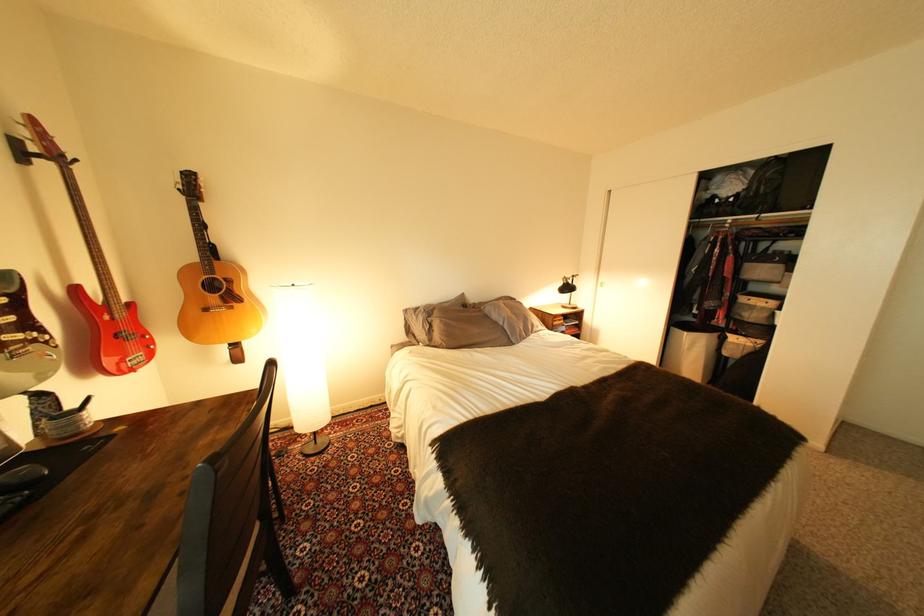
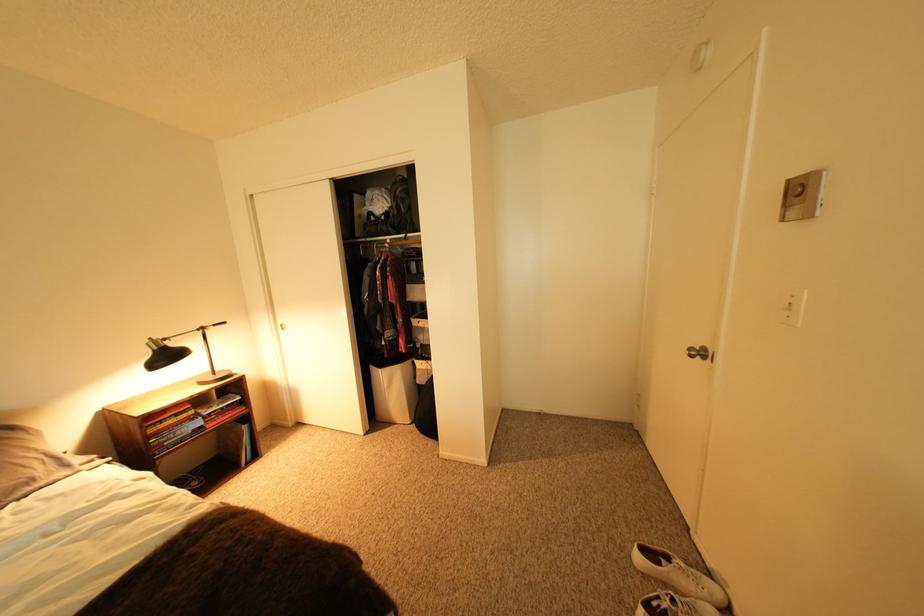
Locate, in the second image, the point that corresponds to (578,284) in the first image.

(168, 350)